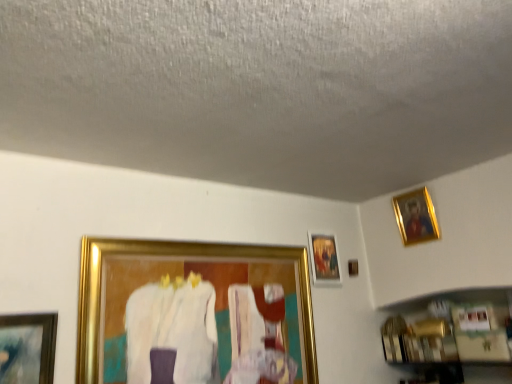
Question: Does point [90, 372] appear closer or farther from the camera than point [400, 225]?

Choices:
 (A) farther
 (B) closer

Answer: (B)

Question: Which is correct: gold metallic picture frame at center-left, arranged as the third picture frame when viewed from the right, is inside gold metallic picture frame at upper right, the 3th picture frame positioned from the left, or outside of it?

Choices:
 (A) outside
 (B) inside

Answer: (A)

Question: Based on their relative distances, which object is farther from the gold-framed painting at upper right, which is counted as the second picture frame, starting from the right?

Choices:
 (A) gold metallic picture frame at center-left, arranged as the third picture frame when viewed from the right
 (B) gold metallic picture frame at upper right, the 3th picture frame positioned from the left

Answer: (B)

Question: Based on their relative distances, which object is farther from the gold metallic picture frame at center-left, arranged as the third picture frame when viewed from the right?

Choices:
 (A) gold-framed painting at upper right, which is counted as the second picture frame, starting from the right
 (B) gold metallic picture frame at upper right, which is counted as the first picture frame, starting from the right

Answer: (B)